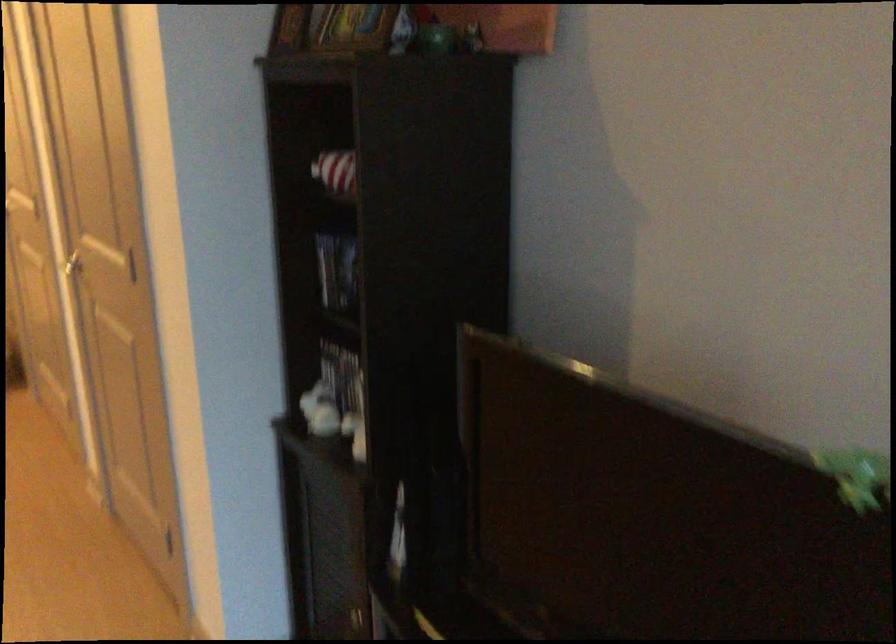
Locate an element on the screen. Image resolution: width=896 pixels, height=644 pixels. red and white ball is located at coordinates (336, 172).